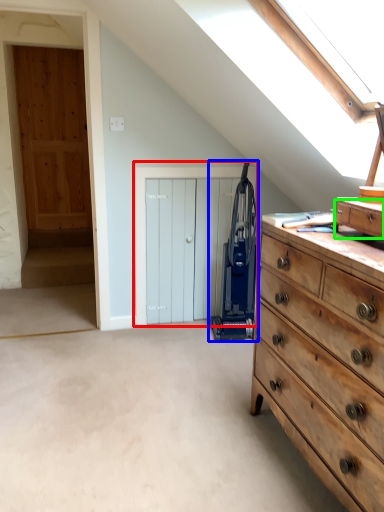
Question: Which object is positioned closest to door (highlighted by a red box)? Select from appliance (highlighted by a blue box) and drawer (highlighted by a green box).

Choices:
 (A) appliance
 (B) drawer

Answer: (A)